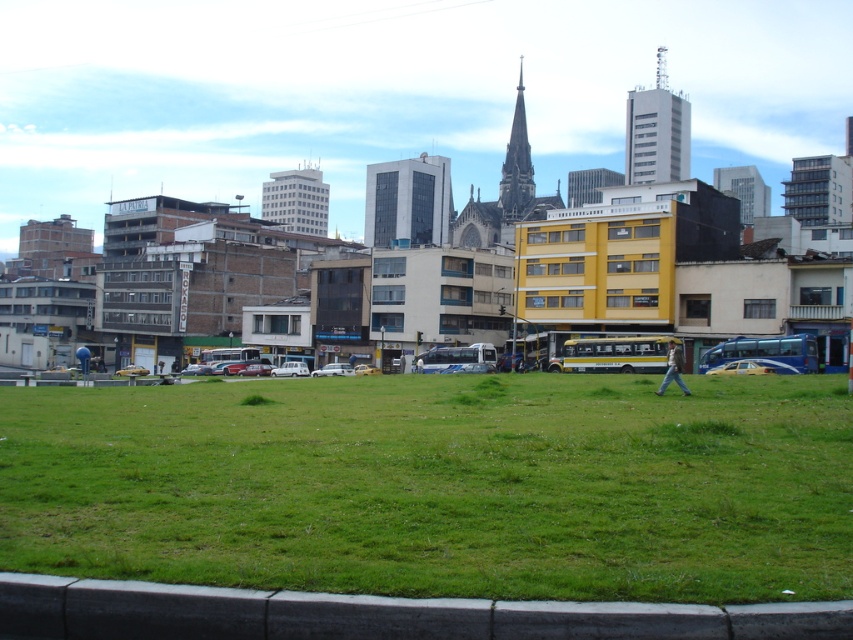
You are a city planner evaluating the space in the urban landscape. The green grassy field at center and the dark gray stone spire at center are both in your view. Which of these two features occupies more horizontal space in the image?

The green grassy field at center might be wider than dark gray stone spire at center according to the description provided.

You are a delivery driver who needs to park your truck, which is 4 meters wide, in this area. Looking at the yellow metallic car at lower right and the matte black car at center, which one has enough space for your truck?

The matte black car at center has a width greater than the yellow metallic car at lower right. Since your truck is 4 meters wide, you need to check if either car provides sufficient space. However, the description only states the relative sizes between the two cars, not their exact widths. Without knowing the exact width of the matte black car at center, it is impossible to determine if it can accommodate your truck.

You are a delivery driver who needs to park your truck between the yellow metallic bus at center and the blue metallic bus at right. Your truck is 10 meters long. Can you fit your truck in the space between them?

The yellow metallic bus at center is wider than the blue metallic bus at right, but the question is about length. The description only provides information about their widths, not the distance between them. Therefore, it is impossible to determine if the truck can fit based on the given information.